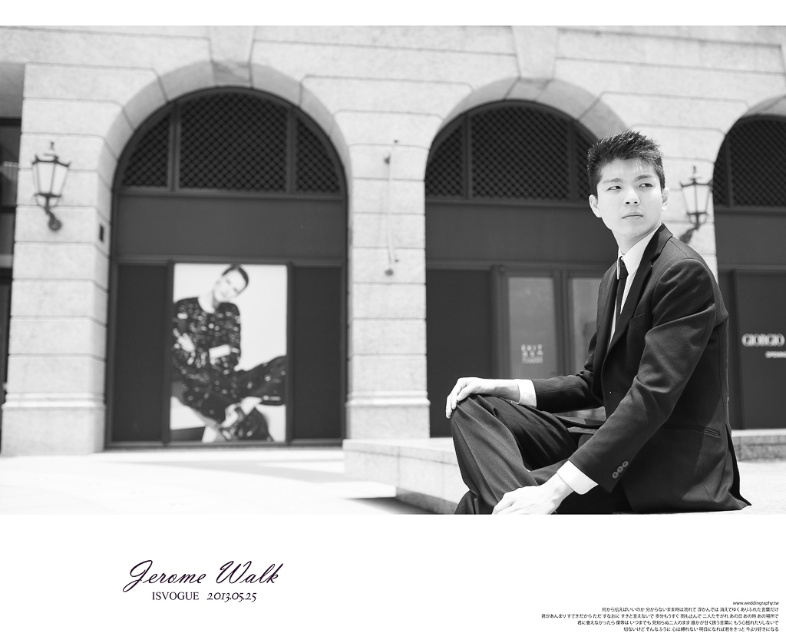
Based on the scene described, can you determine if the smooth black suit at right has a greater width compared to the matte black tie at center?

The smooth black suit at right might be wider than matte black tie at center according to the description.

You are standing at the point with coordinates point (x=616, y=285) and want to walk to the point with coordinates point (x=663, y=252). Which direction should you move relative to the building?

You should move forward towards the building because point (x=663, y=252) is in front of point (x=616, y=285), meaning it is closer to the building.

In the scene shown: You are a fashion designer observing the man in the scene. You need to determine which item of clothing, the smooth black suit at right or the matte black tie at center, has a greater vertical height. Based on the description, which one is taller?

The smooth black suit at right is much taller than the matte black tie at center, so the smooth black suit at right has a greater vertical height.